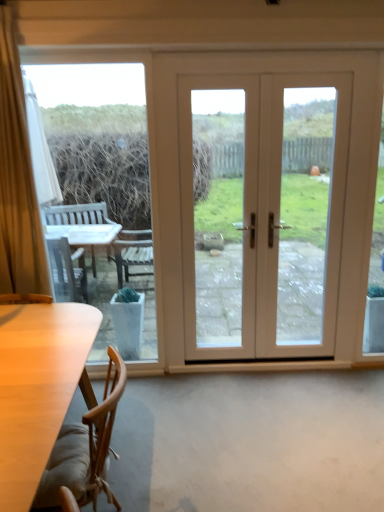
Identify the location of transparent glass table at left. (104, 187).

Considering the points (37, 73) and (290, 315), which point is behind, point (37, 73) or point (290, 315)?

Point (290, 315)

Consider the image. Could white glossy door at center be considered to be inside transparent glass table at left?

No, white glossy door at center is located outside of transparent glass table at left.

From the image's perspective, which is below, transparent glass table at left or white glossy door at center?

transparent glass table at left is shown below in the image.

Could you tell me if transparent glass table at left is turned towards white glossy door at center?

No, transparent glass table at left is not turned towards white glossy door at center.

Which of these two, transparent glass table at left or wooden chair at lower left, is wider?

Wider between the two is wooden chair at lower left.

Is transparent glass table at left oriented away from wooden chair at lower left?

transparent glass table at left is not turned away from wooden chair at lower left.

In terms of height, does transparent glass table at left look taller or shorter compared to wooden chair at lower left?

Clearly, transparent glass table at left is taller compared to wooden chair at lower left.

From a real-world perspective, which is physically above, transparent glass table at left or wooden chair at lower left?

transparent glass table at left is physically above.

Is wooden chair at lower left directly adjacent to white glossy door at center?

There is a gap between wooden chair at lower left and white glossy door at center.

Considering the relative sizes of wooden chair at lower left and white glossy door at center in the image provided, is wooden chair at lower left shorter than white glossy door at center?

Answer: Correct, wooden chair at lower left is not as tall as white glossy door at center.

Visually, is wooden chair at lower left positioned to the left or to the right of white glossy door at center?

Based on their positions, wooden chair at lower left is located to the left of white glossy door at center.

Does point (108, 494) come farther from viewer compared to point (217, 359)?

No, it is not.

Considering the sizes of objects white glossy door at center and wooden chair at lower left in the image provided, who is bigger, white glossy door at center or wooden chair at lower left?

Bigger between the two is white glossy door at center.

Which is more to the right, white glossy door at center or wooden chair at lower left?

From the viewer's perspective, white glossy door at center appears more on the right side.

Considering the relative sizes of white glossy door at center and wooden chair at lower left in the image provided, is white glossy door at center shorter than wooden chair at lower left?

In fact, white glossy door at center may be taller than wooden chair at lower left.

Which is in front, point (318, 289) or point (119, 390)?

The point (119, 390) is closer to the camera.

Based on the photo, from the image's perspective, which one is positioned higher, white glossy door at center or transparent glass table at left?

white glossy door at center appears higher in the image.

At what (x,y) coordinates should I click in order to perform the action: click on window screen in front of the white glossy door at center. Please return your answer as a coordinate pair (x, y). This screenshot has width=384, height=512. Looking at the image, I should click on (104, 187).

Is white glossy door at center at the left side of transparent glass table at left?

Incorrect, white glossy door at center is not on the left side of transparent glass table at left.

In the scene shown: Is wooden chair at lower left positioned beyond the bounds of transparent glass table at left?

Yes, wooden chair at lower left is not within transparent glass table at left.

Between wooden chair at lower left and transparent glass table at left, which one appears on the right side from the viewer's perspective?

wooden chair at lower left is more to the right.

Can you confirm if wooden chair at lower left is taller than transparent glass table at left?

Incorrect, the height of wooden chair at lower left is not larger of that of transparent glass table at left.

Find the location of a particular element. The height and width of the screenshot is (512, 384). door on the right of transparent glass table at left is located at coordinates (263, 213).

This screenshot has height=512, width=384. Find the location of `chair below the transparent glass table at left (from the image's perspective)`. chair below the transparent glass table at left (from the image's perspective) is located at coordinates (84, 451).

Considering their positions, is white glossy door at center positioned further to transparent glass table at left than wooden chair at lower left?

white glossy door at center.

Looking at the image, which one is located closer to white glossy door at center, wooden chair at lower left or transparent glass table at left?

transparent glass table at left lies closer to white glossy door at center than the other object.

From the picture: When comparing their distances from wooden chair at lower left, does white glossy door at center or transparent glass table at left seem closer?

Among the two, transparent glass table at left is located nearer to wooden chair at lower left.

Considering their positions, is transparent glass table at left positioned closer to wooden chair at lower left than white glossy door at center?

transparent glass table at left.

Estimate the real-world distances between objects in this image. Which object is further from transparent glass table at left, wooden chair at lower left or white glossy door at center?

white glossy door at center lies further to transparent glass table at left than the other object.

Consider the image. From the image, which object appears to be farther from white glossy door at center, transparent glass table at left or wooden chair at lower left?

wooden chair at lower left lies further to white glossy door at center than the other object.

At what (x,y) coordinates should I click in order to perform the action: click on window screen located between wooden chair at lower left and white glossy door at center in the depth direction. Please return your answer as a coordinate pair (x, y). Looking at the image, I should click on (104, 187).